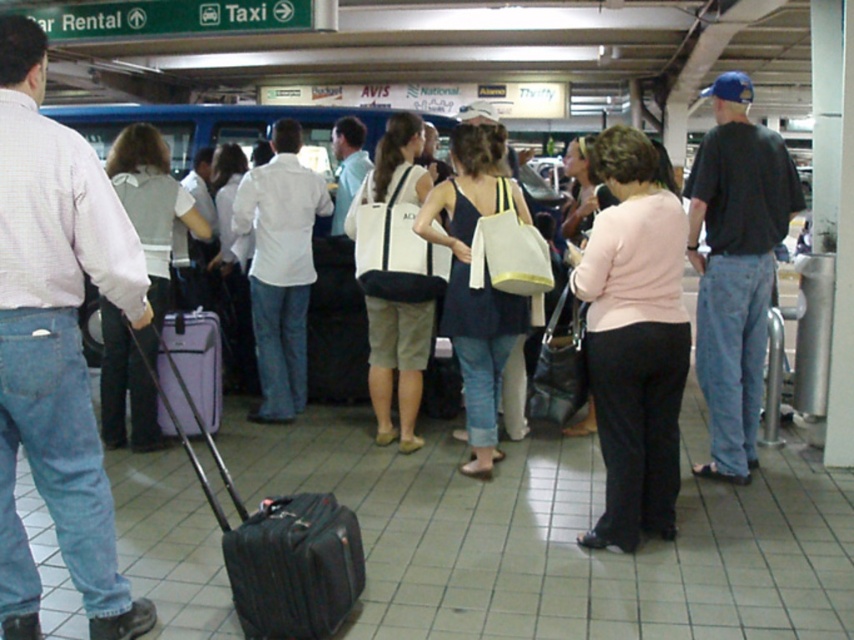
Find the location of a particular element. This screenshot has height=640, width=854. light pink sweater at center is located at coordinates (635, 339).

Can you confirm if light pink sweater at center is thinner than black leather suitcase at center?

Incorrect, light pink sweater at center's width is not less than black leather suitcase at center's.

Who is more distant from viewer, (600, 211) or (346, 269)?

The point (346, 269) is more distant.

Where is `light pink sweater at center`? This screenshot has width=854, height=640. light pink sweater at center is located at coordinates (635, 339).

What do you see at coordinates (635, 339) in the screenshot?
I see `light pink sweater at center` at bounding box center [635, 339].

Can you confirm if light pink sweater at center is thinner than black fabric suitcase at center?

Correct, light pink sweater at center's width is less than black fabric suitcase at center's.

Image resolution: width=854 pixels, height=640 pixels. What do you see at coordinates (635, 339) in the screenshot? I see `light pink sweater at center` at bounding box center [635, 339].

You are a GUI agent. You are given a task and a screenshot of the screen. Output one action in this format:
    pyautogui.click(x=<x>, y=<y>)
    Task: Click on the light pink sweater at center
    
    Given the screenshot: What is the action you would take?
    click(x=635, y=339)

The image size is (854, 640). What do you see at coordinates (276, 541) in the screenshot?
I see `black fabric suitcase at center` at bounding box center [276, 541].

Can you confirm if black fabric suitcase at center is thinner than black leather suitcase at center?

No.

Locate an element on the screen. Image resolution: width=854 pixels, height=640 pixels. black fabric suitcase at center is located at coordinates (276, 541).